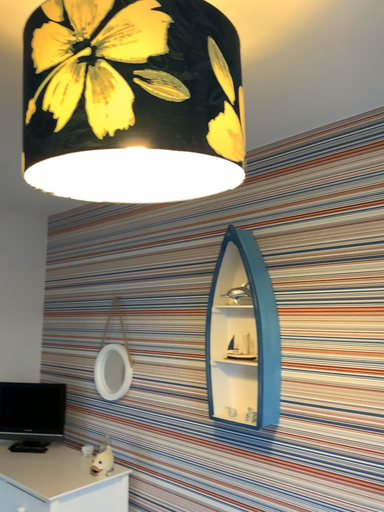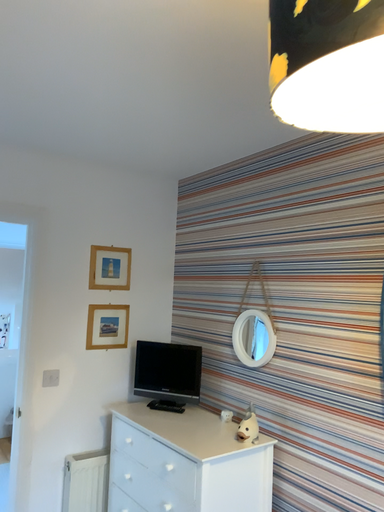
Question: Which way did the camera rotate in the video?

Choices:
 (A) rotated right
 (B) rotated left

Answer: (B)